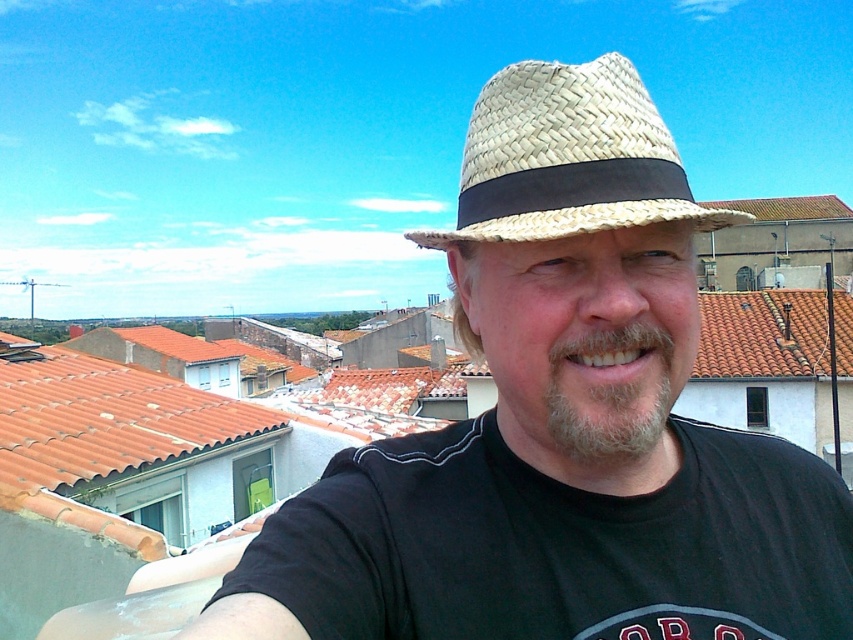
Between woven straw hat at center and woven straw hat at upper center, which one has more height?

woven straw hat at upper center is taller.

Describe the element at coordinates (561, 424) in the screenshot. I see `woven straw hat at center` at that location.

At what (x,y) coordinates should I click in order to perform the action: click on woven straw hat at center. Please return your answer as a coordinate pair (x, y). Looking at the image, I should click on (561, 424).